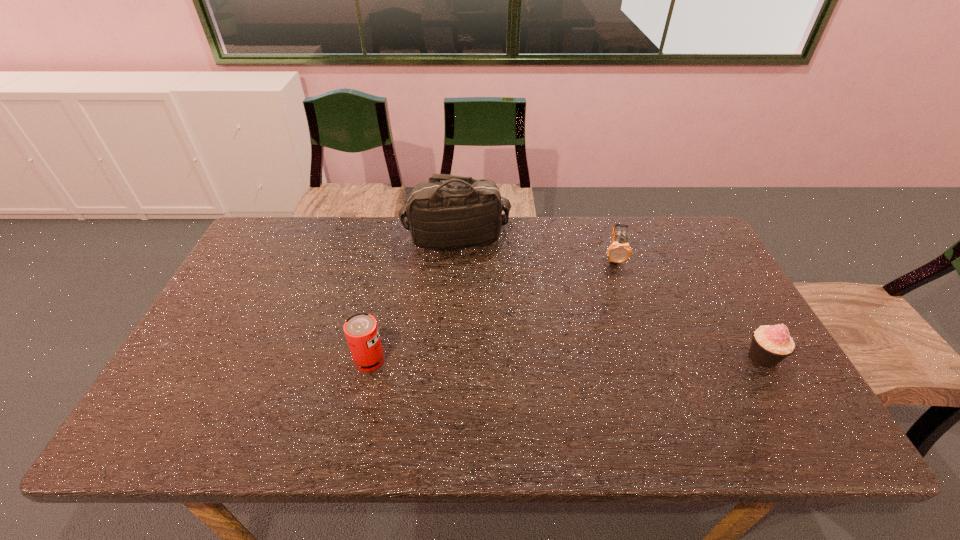
At what (x,y) coordinates should I click in order to perform the action: click on vacant space that's between the second tallest object and the cupcake. Please return your answer as a coordinate pair (x, y). Looking at the image, I should click on (566, 359).

You are a GUI agent. You are given a task and a screenshot of the screen. Output one action in this format:
    pyautogui.click(x=<x>, y=<y>)
    Task: Click on the free space between the rightmost object and the shoulder bag
    The width and height of the screenshot is (960, 540).
    Given the screenshot: What is the action you would take?
    pyautogui.click(x=610, y=298)

Find the location of a particular element. This screenshot has width=960, height=540. free point between the watch and the can is located at coordinates (492, 309).

At what (x,y) coordinates should I click in order to perform the action: click on free space between the second tallest object and the watch. Please return your answer as a coordinate pair (x, y). Looking at the image, I should click on (492, 309).

The image size is (960, 540). Identify the location of vacant point located between the shoulder bag and the watch. (534, 248).

Find the location of a particular element. This screenshot has width=960, height=540. vacant area between the second tallest object and the rightmost object is located at coordinates (566, 359).

What are the coordinates of `vacant space that is in between the second tallest object and the rightmost object` in the screenshot? It's located at (566, 359).

Find the location of a particular element. free space between the rightmost object and the watch is located at coordinates (688, 307).

Locate an element on the screen. Image resolution: width=960 pixels, height=540 pixels. free space between the cupcake and the tallest object is located at coordinates (610, 298).

Choose which object is the second nearest neighbor to the third object from left to right. Please provide its 2D coordinates. Your answer should be formatted as a tuple, i.e. [(x, y)], where the tuple contains the x and y coordinates of a point satisfying the conditions above.

[(770, 345)]